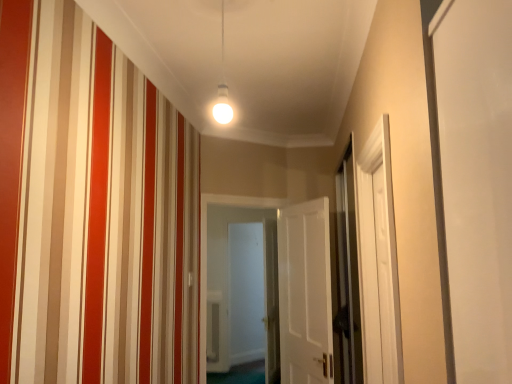
Question: From the image's perspective, relative to white wooden door at center, which ranks as the first door in left-to-right order, is white matte door at center, marked as the 1th door in a right-to-left arrangement, above or below?

Choices:
 (A) below
 (B) above

Answer: (B)

Question: From a real-world perspective, is white matte door at center, which is the second door in left-to-right order, above or below white wooden door at center, the 2th door in the right-to-left sequence?

Choices:
 (A) above
 (B) below

Answer: (B)

Question: Considering the real-world distances, which object is farthest from the white wooden door at center, which ranks as the first door in left-to-right order?

Choices:
 (A) clear glass screen door at right, the second screen door viewed from the back
 (B) white matte door at center, marked as the 1th door in a right-to-left arrangement
 (C) white glossy door at center, acting as the first screen door starting from the left

Answer: (C)

Question: Which object is positioned farthest from the white matte door at center, which is the second door in left-to-right order?

Choices:
 (A) white wooden door at center, which ranks as the first door in left-to-right order
 (B) clear glass screen door at right, arranged as the first screen door when viewed from the front
 (C) white glossy door at center, acting as the first screen door starting from the left

Answer: (C)